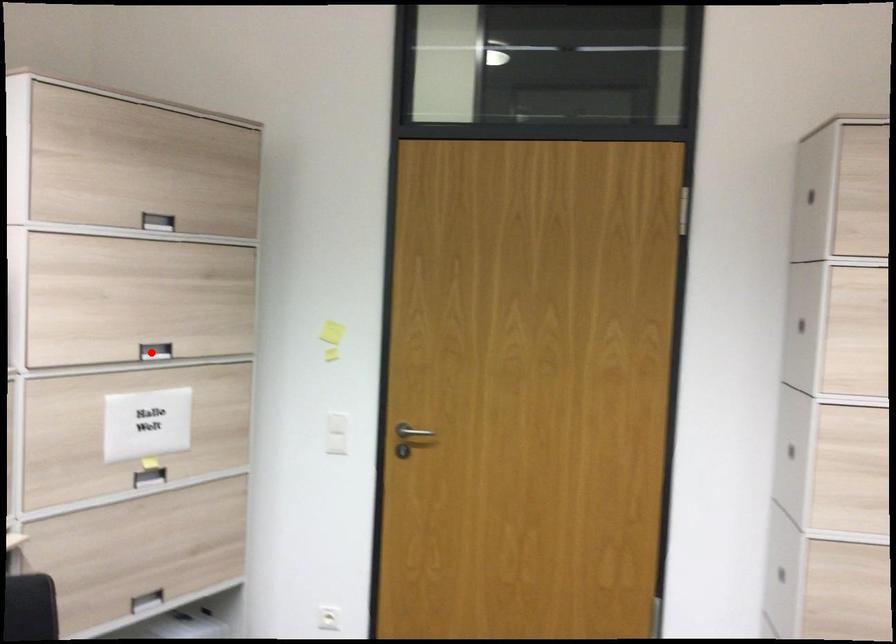
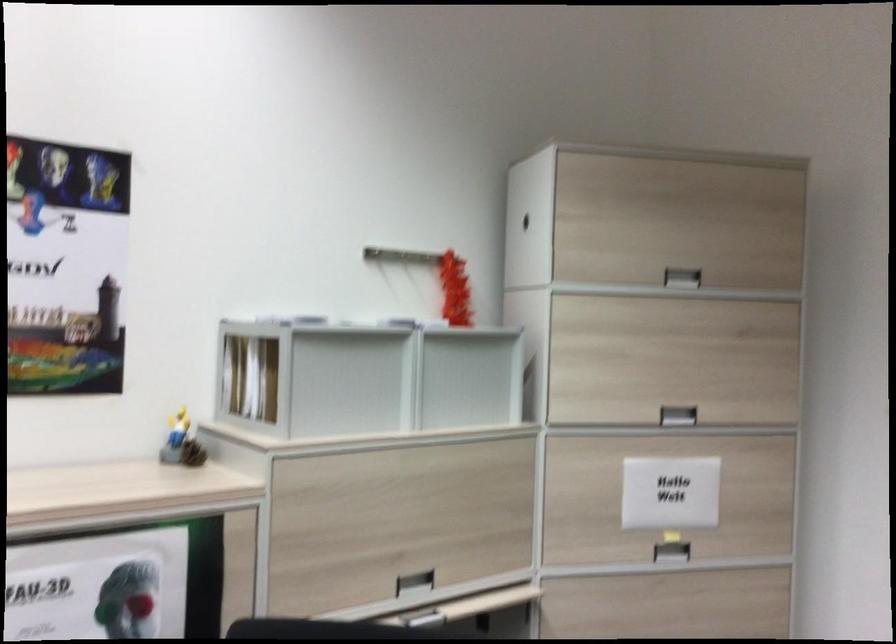
Question: I am providing you with two images of the same scene from different viewpoints. A red point is marked on the first image. Is the red point's position out of view in image 2?

Choices:
 (A) Yes
 (B) No

Answer: (B)